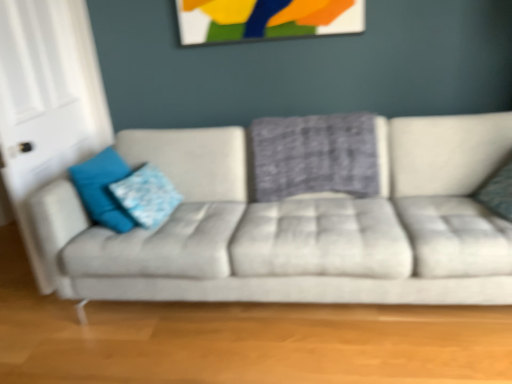
This screenshot has height=384, width=512. What do you see at coordinates (47, 102) in the screenshot?
I see `white glossy door at left` at bounding box center [47, 102].

You are a GUI agent. You are given a task and a screenshot of the screen. Output one action in this format:
    pyautogui.click(x=<x>, y=<y>)
    Task: Click on the white glossy door at left
    
    Given the screenshot: What is the action you would take?
    pyautogui.click(x=47, y=102)

Identify the location of plaid fabric pillow at center, which is the third pillow in left-to-right order. (314, 156).

The height and width of the screenshot is (384, 512). Describe the element at coordinates (102, 189) in the screenshot. I see `blue fabric pillow at left, the 1th pillow viewed from the left` at that location.

This screenshot has height=384, width=512. What do you see at coordinates (266, 19) in the screenshot?
I see `painted wood picture frame at upper center` at bounding box center [266, 19].

This screenshot has width=512, height=384. In order to click on teal fabric pillow at right, marked as the 1th pillow in a right-to-left arrangement in this screenshot , I will do `click(498, 192)`.

From the image's perspective, between blue fabric pillow at left, acting as the 2th pillow starting from the left, and blue fabric pillow at left, the 1th pillow viewed from the left, which one is located above?

From the image's view, blue fabric pillow at left, the 1th pillow viewed from the left, is above.

Which of these two, blue fabric pillow at left, which ranks as the third pillow in right-to-left order, or blue fabric pillow at left, marked as the fourth pillow in a right-to-left arrangement, is smaller?

With smaller size is blue fabric pillow at left, which ranks as the third pillow in right-to-left order.

Between point (154, 168) and point (108, 189), which one is positioned behind?

The point (154, 168) is farther from the camera.

Is white glossy door at left in front of blue fabric pillow at left, the 1th pillow viewed from the left?

Yes, white glossy door at left is in front of blue fabric pillow at left, the 1th pillow viewed from the left.

Is white glossy door at left facing towards blue fabric pillow at left, marked as the fourth pillow in a right-to-left arrangement?

Yes, white glossy door at left is oriented towards blue fabric pillow at left, marked as the fourth pillow in a right-to-left arrangement.

Does point (87, 40) appear closer or farther from the camera than point (106, 158)?

Point (87, 40) is farther from the camera than point (106, 158).

Is blue fabric pillow at left, which ranks as the third pillow in right-to-left order, outside of painted wood picture frame at upper center?

blue fabric pillow at left, which ranks as the third pillow in right-to-left order, lies outside painted wood picture frame at upper center's area.

In order to click on picture frame located above the blue fabric pillow at left, acting as the 2th pillow starting from the left (from a real-world perspective) in this screenshot , I will do `click(266, 19)`.

Considering the positions of objects blue fabric pillow at left, acting as the 2th pillow starting from the left, and painted wood picture frame at upper center in the image provided, who is behind, blue fabric pillow at left, acting as the 2th pillow starting from the left, or painted wood picture frame at upper center?

painted wood picture frame at upper center.

Is blue fabric pillow at left, acting as the 2th pillow starting from the left, bigger or smaller than painted wood picture frame at upper center?

In the image, blue fabric pillow at left, acting as the 2th pillow starting from the left, appears to be larger than painted wood picture frame at upper center.

Could you tell me if textured gray couch at center is facing teal fabric pillow at right, marked as the 1th pillow in a right-to-left arrangement?

Yes, textured gray couch at center is oriented towards teal fabric pillow at right, marked as the 1th pillow in a right-to-left arrangement.

What are the coordinates of `studio couch below the teal fabric pillow at right, marked as the 1th pillow in a right-to-left arrangement (from a real-world perspective)` in the screenshot? It's located at pyautogui.click(x=298, y=226).

Is textured gray couch at center far from teal fabric pillow at right, marked as the 1th pillow in a right-to-left arrangement?

They are positioned close to each other.

Considering the relative positions of textured gray couch at center and teal fabric pillow at right, which is the 4th pillow in left-to-right order, in the image provided, is textured gray couch at center to the right of teal fabric pillow at right, which is the 4th pillow in left-to-right order, from the viewer's perspective?

No.

Is plaid fabric pillow at center, which is the third pillow in left-to-right order, positioned beyond the bounds of blue fabric pillow at left, acting as the 2th pillow starting from the left?

Yes, plaid fabric pillow at center, which is the third pillow in left-to-right order, is located beyond the bounds of blue fabric pillow at left, acting as the 2th pillow starting from the left.

Is plaid fabric pillow at center, which is the third pillow in left-to-right order, far away from blue fabric pillow at left, acting as the 2th pillow starting from the left?

plaid fabric pillow at center, which is the third pillow in left-to-right order, is actually quite close to blue fabric pillow at left, acting as the 2th pillow starting from the left.

Is point (376, 183) positioned after point (153, 197)?

Yes, point (376, 183) is farther from viewer.

Choose the correct answer: Is plaid fabric pillow at center, marked as the second pillow in a right-to-left arrangement, inside painted wood picture frame at upper center or outside it?

plaid fabric pillow at center, marked as the second pillow in a right-to-left arrangement, is not inside painted wood picture frame at upper center, it's outside.

From a real-world perspective, is plaid fabric pillow at center, which is the third pillow in left-to-right order, on top of painted wood picture frame at upper center?

No, from a real-world perspective, plaid fabric pillow at center, which is the third pillow in left-to-right order, is not over painted wood picture frame at upper center

Considering the positions of objects plaid fabric pillow at center, marked as the second pillow in a right-to-left arrangement, and painted wood picture frame at upper center in the image provided, who is more to the right, plaid fabric pillow at center, marked as the second pillow in a right-to-left arrangement, or painted wood picture frame at upper center?

plaid fabric pillow at center, marked as the second pillow in a right-to-left arrangement.

What's the angular difference between plaid fabric pillow at center, marked as the second pillow in a right-to-left arrangement, and painted wood picture frame at upper center's facing directions?

The angular difference between plaid fabric pillow at center, marked as the second pillow in a right-to-left arrangement, and painted wood picture frame at upper center is 1.15 degrees.

Which is farther, [501,186] or [180,207]?

The point [180,207] is more distant.

Who is bigger, teal fabric pillow at right, marked as the 1th pillow in a right-to-left arrangement, or textured gray couch at center?

With larger size is textured gray couch at center.

Which object is positioned more to the left, teal fabric pillow at right, marked as the 1th pillow in a right-to-left arrangement, or textured gray couch at center?

From the viewer's perspective, textured gray couch at center appears more on the left side.

Considering the sizes of objects teal fabric pillow at right, which is the 4th pillow in left-to-right order, and textured gray couch at center in the image provided, who is shorter, teal fabric pillow at right, which is the 4th pillow in left-to-right order, or textured gray couch at center?

teal fabric pillow at right, which is the 4th pillow in left-to-right order, is shorter.

From the blue fabric pillow at left, marked as the fourth pillow in a right-to-left arrangement, count 1st pillow to the right and point to it. Please provide its 2D coordinates.

[(146, 196)]

Where is `glass door in front of the blue fabric pillow at left, the 1th pillow viewed from the left`? This screenshot has height=384, width=512. glass door in front of the blue fabric pillow at left, the 1th pillow viewed from the left is located at coordinates (47, 102).

Estimate the real-world distances between objects in this image. Which object is further from blue fabric pillow at left, the 1th pillow viewed from the left, textured gray couch at center or white glossy door at left?

textured gray couch at center is further to blue fabric pillow at left, the 1th pillow viewed from the left.

Estimate the real-world distances between objects in this image. Which object is closer to painted wood picture frame at upper center, blue fabric pillow at left, the 1th pillow viewed from the left, or teal fabric pillow at right, which is the 4th pillow in left-to-right order?

Based on the image, blue fabric pillow at left, the 1th pillow viewed from the left, appears to be nearer to painted wood picture frame at upper center.

From the image, which object appears to be farther from textured gray couch at center, blue fabric pillow at left, the 1th pillow viewed from the left, or blue fabric pillow at left, which ranks as the third pillow in right-to-left order?

blue fabric pillow at left, the 1th pillow viewed from the left, lies further to textured gray couch at center than the other object.

Based on their spatial positions, is white glossy door at left or blue fabric pillow at left, acting as the 2th pillow starting from the left, closer to plaid fabric pillow at center, marked as the second pillow in a right-to-left arrangement?

blue fabric pillow at left, acting as the 2th pillow starting from the left, is closer to plaid fabric pillow at center, marked as the second pillow in a right-to-left arrangement.

Which object lies nearer to the anchor point white glossy door at left, blue fabric pillow at left, acting as the 2th pillow starting from the left, or blue fabric pillow at left, the 1th pillow viewed from the left?

blue fabric pillow at left, the 1th pillow viewed from the left, lies closer to white glossy door at left than the other object.

Which object lies further to the anchor point blue fabric pillow at left, acting as the 2th pillow starting from the left, textured gray couch at center or white glossy door at left?

Based on the image, white glossy door at left appears to be further to blue fabric pillow at left, acting as the 2th pillow starting from the left.

When comparing their distances from plaid fabric pillow at center, marked as the second pillow in a right-to-left arrangement, does blue fabric pillow at left, which ranks as the third pillow in right-to-left order, or textured gray couch at center seem closer?

Based on the image, textured gray couch at center appears to be nearer to plaid fabric pillow at center, marked as the second pillow in a right-to-left arrangement.

Which object lies further to the anchor point plaid fabric pillow at center, which is the third pillow in left-to-right order, blue fabric pillow at left, the 1th pillow viewed from the left, or teal fabric pillow at right, marked as the 1th pillow in a right-to-left arrangement?

blue fabric pillow at left, the 1th pillow viewed from the left, is positioned further to the anchor plaid fabric pillow at center, which is the third pillow in left-to-right order.

Locate an element on the screen. Image resolution: width=512 pixels, height=384 pixels. picture frame located between white glossy door at left and teal fabric pillow at right, which is the 4th pillow in left-to-right order, in the left-right direction is located at coordinates coord(266,19).

Where is `pillow situated between white glossy door at left and blue fabric pillow at left, which ranks as the third pillow in right-to-left order, from left to right`? This screenshot has height=384, width=512. pillow situated between white glossy door at left and blue fabric pillow at left, which ranks as the third pillow in right-to-left order, from left to right is located at coordinates (102, 189).

Image resolution: width=512 pixels, height=384 pixels. Identify the location of studio couch between blue fabric pillow at left, acting as the 2th pillow starting from the left, and teal fabric pillow at right, which is the 4th pillow in left-to-right order, from left to right. (298, 226).

Where is `studio couch between blue fabric pillow at left, the 1th pillow viewed from the left, and teal fabric pillow at right, marked as the 1th pillow in a right-to-left arrangement, from left to right`? The height and width of the screenshot is (384, 512). studio couch between blue fabric pillow at left, the 1th pillow viewed from the left, and teal fabric pillow at right, marked as the 1th pillow in a right-to-left arrangement, from left to right is located at coordinates (298, 226).